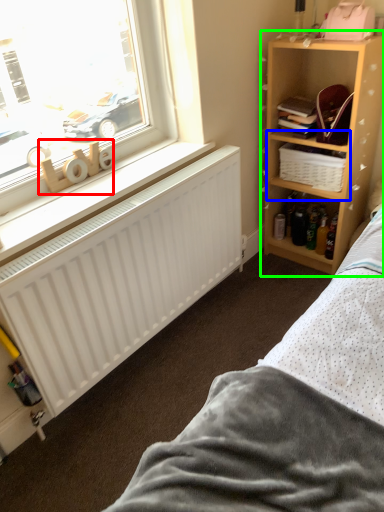
Question: Considering the real-world distances, which object is closest to toy (highlighted by a red box)? cabinet (highlighted by a blue box) or shelf (highlighted by a green box).

Choices:
 (A) cabinet
 (B) shelf

Answer: (A)